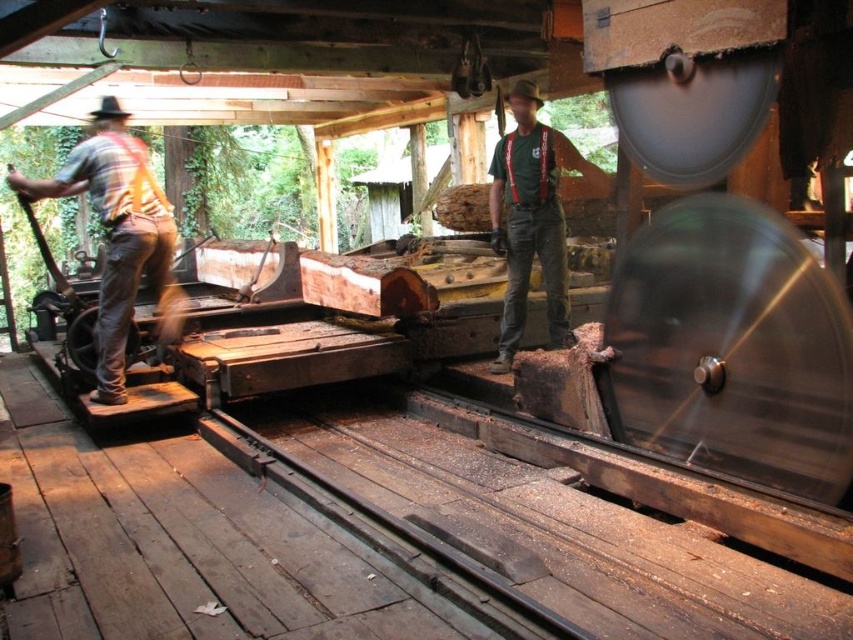
Is rustic wood shirt at left taller than green fabric shirt at center?

Incorrect, rustic wood shirt at left's height is not larger of green fabric shirt at center's.

Is rustic wood shirt at left to the right of green fabric shirt at center from the viewer's perspective?

Incorrect, rustic wood shirt at left is not on the right side of green fabric shirt at center.

Does point (143, 205) lie behind point (511, 348)?

No, it is not.

Where is `rustic wood shirt at left`? The width and height of the screenshot is (853, 640). rustic wood shirt at left is located at coordinates (119, 236).